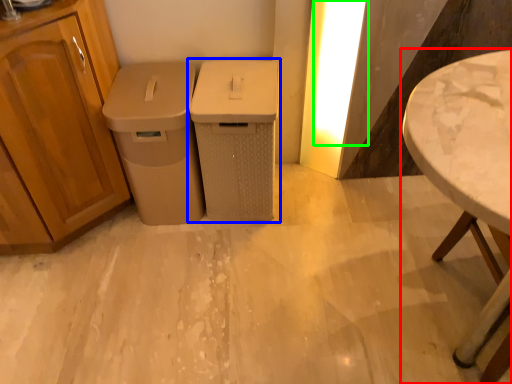
Question: Which object is positioned farthest from table (highlighted by a red box)? Select from waste container (highlighted by a blue box) and light (highlighted by a green box).

Choices:
 (A) waste container
 (B) light

Answer: (A)